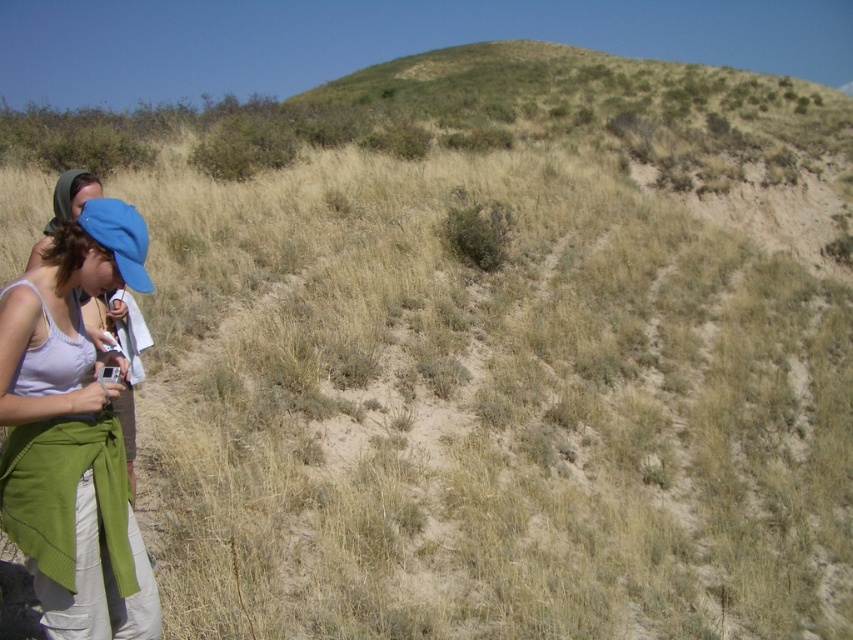
Consider the image. You are standing at the center of the image. There is a green knitted scarf at lower left. Where is the green knitted scarf located relative to your position?

The green knitted scarf at lower left is located at the lower left position relative to your standing position at the center of the image.

You are planning to take a photo of the matte white tank top at lower left and the blue fabric cap at left. Which object should you focus on first if you want to capture both in the same frame without moving the camera?

The matte white tank top at lower left is located below the blue fabric cap at left, so you should focus on the blue fabric cap at left first to ensure both are in the frame.